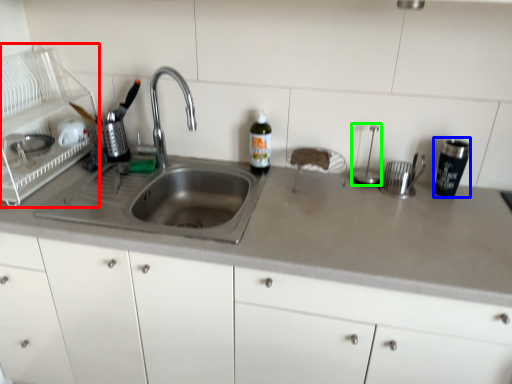
Question: Which object is positioned farthest from appliance (highlighted by a red box)? Select from tableware (highlighted by a blue box) and appliance (highlighted by a green box).

Choices:
 (A) tableware
 (B) appliance

Answer: (A)